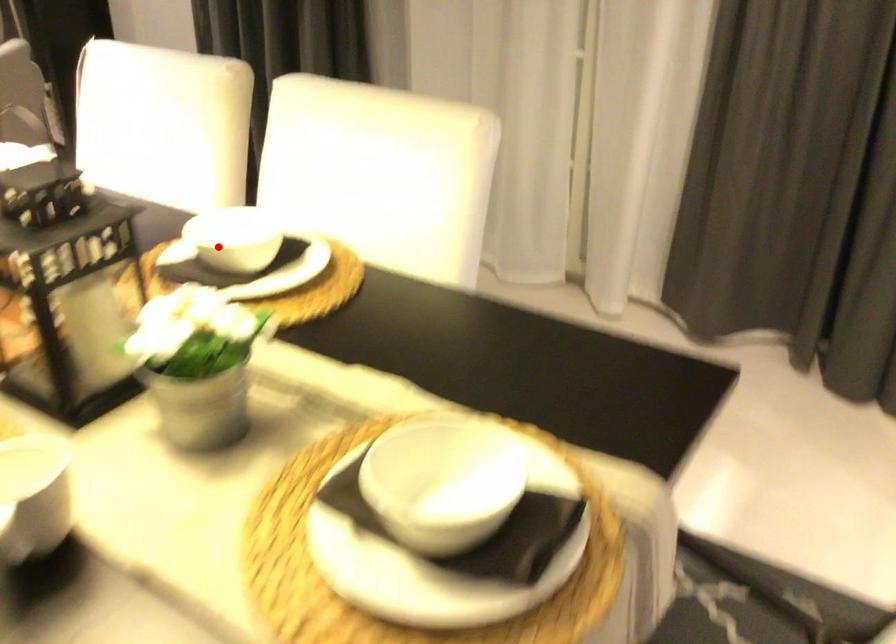
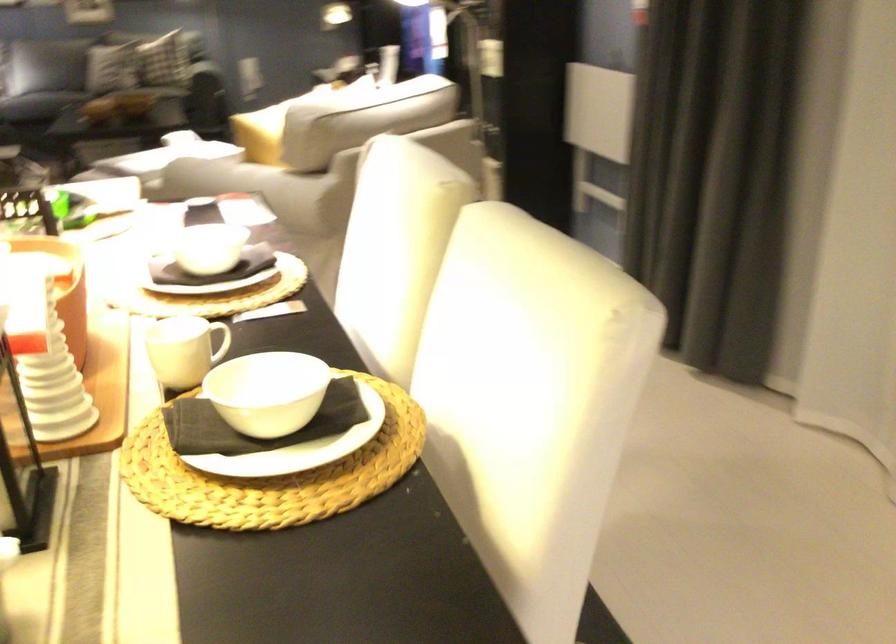
Locate, in the second image, the point that corresponds to the highlighted location in the first image.

(268, 392)